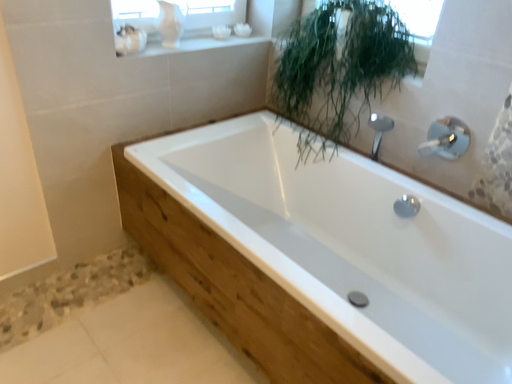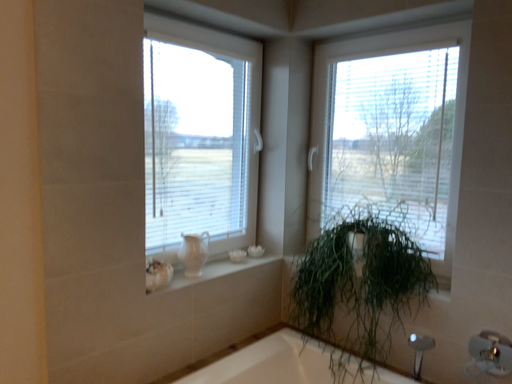
Question: Which way did the camera rotate in the video?

Choices:
 (A) rotated downward
 (B) rotated upward

Answer: (B)